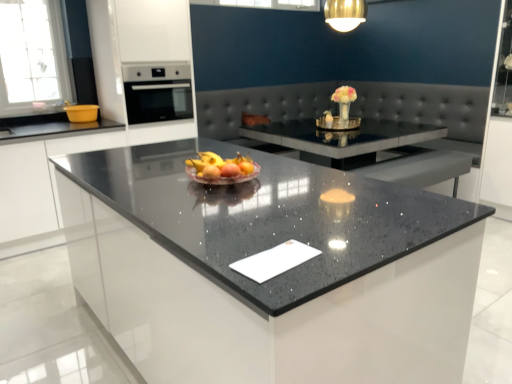
Question: Is glossy white oven at upper left, which ranks as the 1th cabinetry in right-to-left order, thinner than yellow plastic bowl at left?

Choices:
 (A) yes
 (B) no

Answer: (B)

Question: From the image's perspective, is glossy white oven at upper left, which is the 2th cabinetry from left to right, on yellow plastic bowl at left?

Choices:
 (A) no
 (B) yes

Answer: (B)

Question: Is yellow plastic bowl at left at the back of glossy white oven at upper left, which ranks as the 1th cabinetry in right-to-left order?

Choices:
 (A) yes
 (B) no

Answer: (B)

Question: Does glossy white oven at upper left, which is the 2th cabinetry from left to right, have a greater width compared to yellow plastic bowl at left?

Choices:
 (A) yes
 (B) no

Answer: (A)

Question: Is the depth of glossy white oven at upper left, which ranks as the 1th cabinetry in right-to-left order, less than that of yellow plastic bowl at left?

Choices:
 (A) yes
 (B) no

Answer: (A)

Question: From a real-world perspective, is glossy white oven at upper left, which is the 2th cabinetry from left to right, positioned above or below black granite countertop at center?

Choices:
 (A) below
 (B) above

Answer: (B)

Question: Is glossy white oven at upper left, which is the 2th cabinetry from left to right, to the left or to the right of black granite countertop at center in the image?

Choices:
 (A) left
 (B) right

Answer: (A)

Question: Considering the positions of glossy white oven at upper left, which ranks as the 1th cabinetry in right-to-left order, and black granite countertop at center in the image, is glossy white oven at upper left, which ranks as the 1th cabinetry in right-to-left order, taller or shorter than black granite countertop at center?

Choices:
 (A) tall
 (B) short

Answer: (A)

Question: In terms of width, does glossy white oven at upper left, which is the 2th cabinetry from left to right, look wider or thinner when compared to black granite countertop at center?

Choices:
 (A) thin
 (B) wide

Answer: (A)

Question: Is point (169, 112) positioned closer to the camera than point (182, 1)?

Choices:
 (A) closer
 (B) farther

Answer: (B)

Question: In terms of width, does satin black oven at upper left look wider or thinner when compared to glossy white oven at upper left, which is the 2th cabinetry from left to right?

Choices:
 (A) thin
 (B) wide

Answer: (B)

Question: Considering the relative positions of satin black oven at upper left and glossy white oven at upper left, which is the 2th cabinetry from left to right, in the image provided, is satin black oven at upper left to the left or to the right of glossy white oven at upper left, which is the 2th cabinetry from left to right,?

Choices:
 (A) left
 (B) right

Answer: (B)

Question: From the image's perspective, is satin black oven at upper left positioned above or below glossy white oven at upper left, which is the 2th cabinetry from left to right?

Choices:
 (A) above
 (B) below

Answer: (A)

Question: In terms of height, does glossy white oven at upper left, which is the 2th cabinetry from left to right, look taller or shorter compared to translucent glass bowl at center?

Choices:
 (A) tall
 (B) short

Answer: (A)

Question: Would you say glossy white oven at upper left, which ranks as the 1th cabinetry in right-to-left order, is to the left or to the right of translucent glass bowl at center in the picture?

Choices:
 (A) right
 (B) left

Answer: (B)